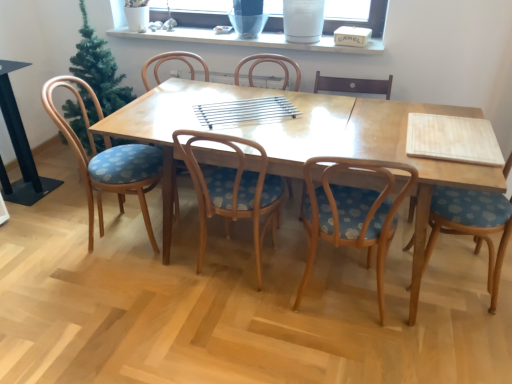
Question: Based on their positions, is blue fabric chair at right, the first chair positioned from the right, located to the left or right of transparent glass window screen at upper center?

Choices:
 (A) left
 (B) right

Answer: (B)

Question: Is point pyautogui.click(x=506, y=175) positioned closer to the camera than point pyautogui.click(x=189, y=19)?

Choices:
 (A) closer
 (B) farther

Answer: (A)

Question: Considering the real-world distances, which object is farthest from the wooden chair with floral cushion at center, the 3th chair in the right-to-left sequence?

Choices:
 (A) transparent glass window screen at upper center
 (B) wooden chair with blue cushion at center, which is counted as the 4th chair, starting from the right
 (C) wooden chair with blue patterned seat at center, which is the second chair in left-to-right order
 (D) wooden chair with blue floral cushion at left, acting as the sixth chair starting from the right
 (E) white ceramic vase at upper center

Answer: (B)

Question: Estimate the real-world distances between objects in this image. Which object is closer to the wooden chair with blue floral cushion at left, acting as the first chair starting from the left?

Choices:
 (A) wooden chair with floral cushion at center, the 3th chair in the right-to-left sequence
 (B) transparent glass window screen at upper center
 (C) light brown wooden table at center
 (D) blue fabric chair at right, the 6th chair in the left-to-right sequence
 (E) wooden chair with blue patterned seat at center, which is the second chair in left-to-right order

Answer: (C)